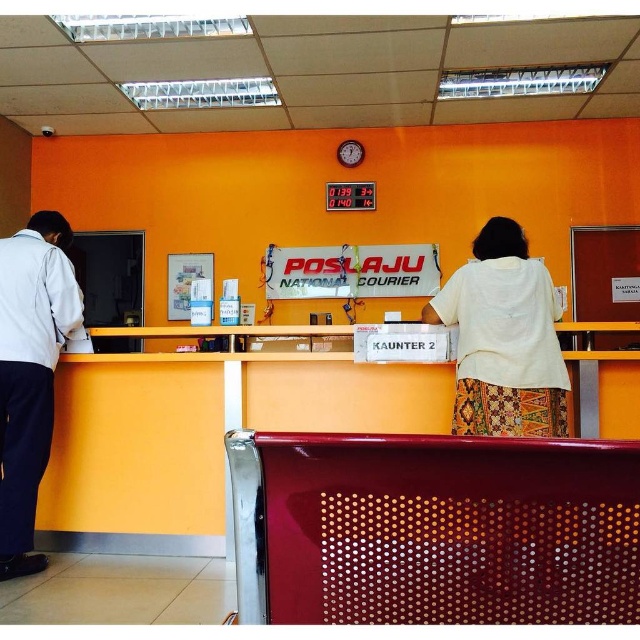
You are a customer standing at the entrance of the Poslaju National Courier service counter. You need to find the yellow matte desk at left to drop off your package. According to the layout, where should you look for it?

The yellow matte desk at left is located at the 2D coordinates point (200,435), so you should look towards the left side of the counter area at that specific coordinate point.

You are a customer at the Poslaju National Courier service counter. You see a white fabric at center and a white shirt at left. Which item is closer to you?

The white fabric at center is closer to you because it is in front of the white shirt at left.